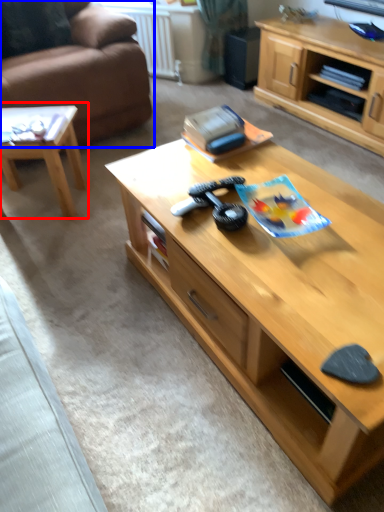
Question: Which point is further to the camera, coffee table (highlighted by a red box) or studio couch (highlighted by a blue box)?

Choices:
 (A) coffee table
 (B) studio couch

Answer: (B)